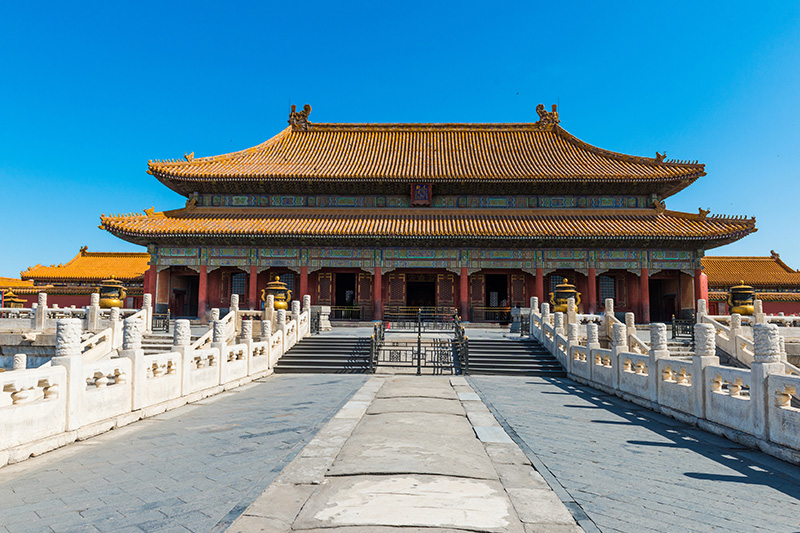
I want to click on red pillars, so click(x=150, y=282), click(x=202, y=282), click(x=252, y=279), click(x=304, y=279), click(x=378, y=287), click(x=466, y=287), click(x=542, y=286), click(x=594, y=288), click(x=648, y=287), click(x=700, y=293).